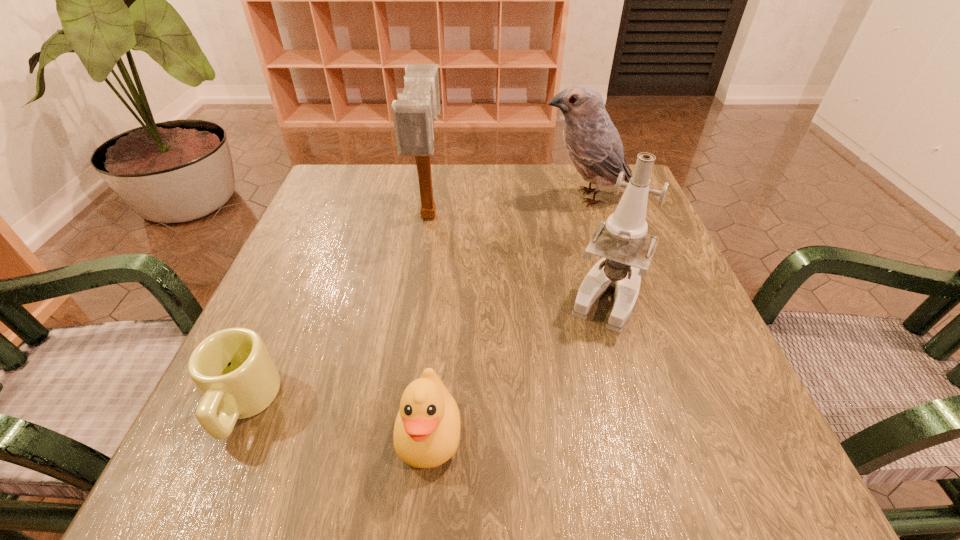
You are a GUI agent. You are given a task and a screenshot of the screen. Output one action in this format:
    pyautogui.click(x=<x>, y=<y>)
    Task: Click on the mallet
    The width and height of the screenshot is (960, 540).
    Given the screenshot: What is the action you would take?
    [x=414, y=113]

Locate an element on the screen. the third farthest object is located at coordinates (627, 250).

Where is `parrot`? parrot is located at coordinates (592, 142).

This screenshot has height=540, width=960. I want to click on duck, so click(x=426, y=434).

Image resolution: width=960 pixels, height=540 pixels. Find the location of `the leftmost object`. the leftmost object is located at coordinates (232, 368).

This screenshot has height=540, width=960. I want to click on the shortest object, so click(x=232, y=368).

The width and height of the screenshot is (960, 540). I want to click on vacant space located 0.130m on the back of the mallet, so click(x=437, y=164).

I want to click on free space located on the left of the microscope, so click(x=415, y=295).

I want to click on free region located 0.260m on the front-facing side of the parrot, so click(x=432, y=197).

Where is `vacant region located 0.370m on the front-facing side of the parrot`? vacant region located 0.370m on the front-facing side of the parrot is located at coordinates (387, 197).